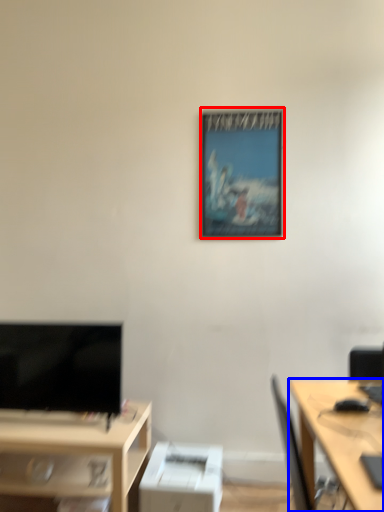
Question: Among these objects, which one is farthest to the camera, picture frame (highlighted by a red box) or desk (highlighted by a blue box)?

Choices:
 (A) picture frame
 (B) desk

Answer: (A)